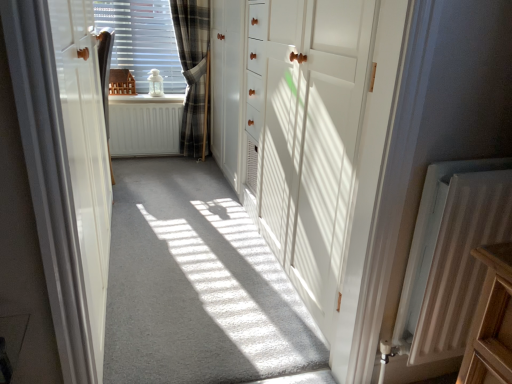
I want to click on free space between plaid fabric curtain at center, which is the 2th curtain from left to right, and white matte radiator at center, the 2th radiator when ordered from front to back, so click(140, 162).